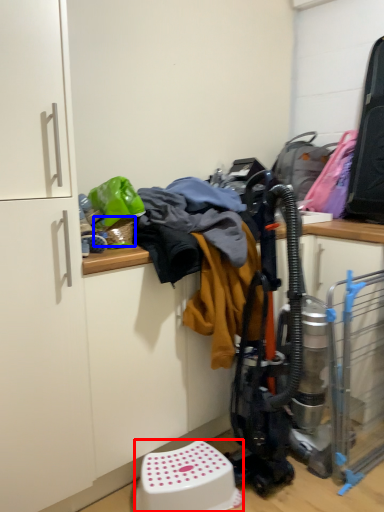
Question: Which object is further to the camera taking this photo, step stool (highlighted by a red box) or basket (highlighted by a blue box)?

Choices:
 (A) step stool
 (B) basket

Answer: (B)